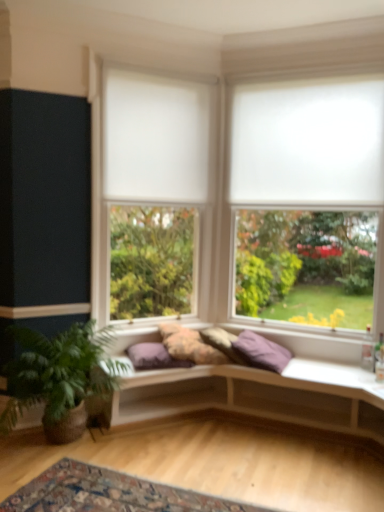
Question: Does white matte window at upper right, which is the 1th window in right-to-left order, have a greater height compared to purple fabric pillow at center, which is counted as the 2th pillow, starting from the left?

Choices:
 (A) yes
 (B) no

Answer: (A)

Question: Does white matte window at upper right, which is the 1th window in right-to-left order, appear on the left side of purple fabric pillow at center, which is counted as the 2th pillow, starting from the left?

Choices:
 (A) yes
 (B) no

Answer: (B)

Question: Is white matte window at upper right, marked as the second window in a left-to-right arrangement, outside of purple fabric pillow at center, which is counted as the 2th pillow, starting from the left?

Choices:
 (A) no
 (B) yes

Answer: (B)

Question: From a real-world perspective, is white matte window at upper right, marked as the second window in a left-to-right arrangement, located higher than purple fabric pillow at center, which is counted as the 2th pillow, starting from the left?

Choices:
 (A) no
 (B) yes

Answer: (B)

Question: Is white matte window at upper right, which is the 1th window in right-to-left order, looking in the opposite direction of purple fabric pillow at center, which is counted as the 2th pillow, starting from the left?

Choices:
 (A) no
 (B) yes

Answer: (A)

Question: Could you tell me if white matte window at upper right, marked as the second window in a left-to-right arrangement, is facing purple fabric pillow at center, which appears as the second pillow when viewed from the right?

Choices:
 (A) yes
 (B) no

Answer: (A)

Question: Is white matte curtain at upper center looking in the opposite direction of fluffy fabric pillow at center, marked as the first pillow in a left-to-right arrangement?

Choices:
 (A) no
 (B) yes

Answer: (A)

Question: Can you confirm if white matte curtain at upper center is wider than fluffy fabric pillow at center, which is the third pillow in right-to-left order?

Choices:
 (A) yes
 (B) no

Answer: (B)

Question: From the image's perspective, is white matte curtain at upper center beneath fluffy fabric pillow at center, which is the third pillow in right-to-left order?

Choices:
 (A) no
 (B) yes

Answer: (A)

Question: Could you tell me if white matte curtain at upper center is facing fluffy fabric pillow at center, marked as the first pillow in a left-to-right arrangement?

Choices:
 (A) yes
 (B) no

Answer: (B)

Question: Is white matte curtain at upper center closer to the viewer compared to fluffy fabric pillow at center, marked as the first pillow in a left-to-right arrangement?

Choices:
 (A) no
 (B) yes

Answer: (A)

Question: Are white matte curtain at upper center and fluffy fabric pillow at center, marked as the first pillow in a left-to-right arrangement, far apart?

Choices:
 (A) yes
 (B) no

Answer: (A)

Question: From a real-world perspective, does purple fabric pillow at center, which is counted as the 2th pillow, starting from the left, stand above green leafy plant at lower left?

Choices:
 (A) yes
 (B) no

Answer: (A)